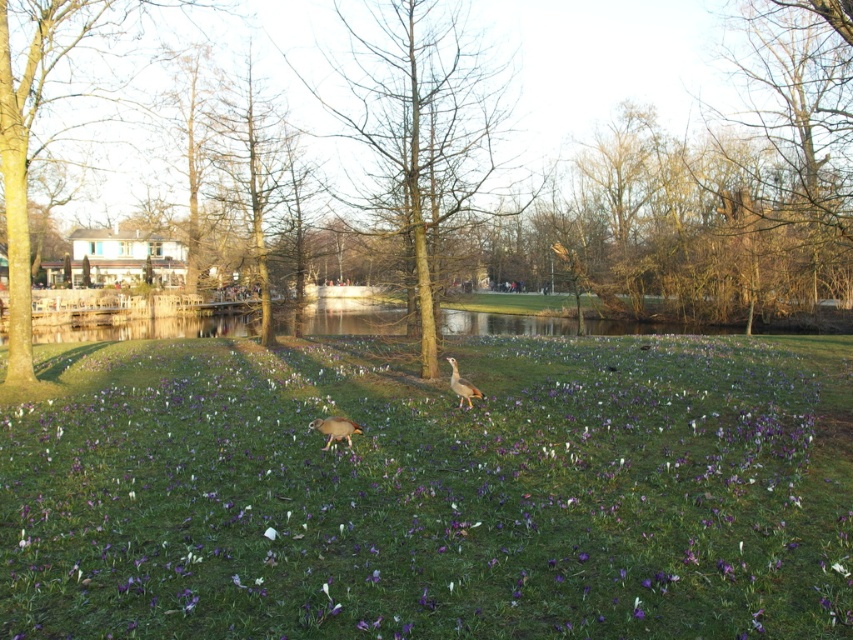
Who is positioned more to the right, green matte tree at center or brown/dry wood tree at center?

brown/dry wood tree at center is more to the right.

Is green matte tree at center behind brown/dry wood tree at center?

No, it is not.

Is point (473, 268) behind point (370, 109)?

Yes, point (473, 268) is behind point (370, 109).

Where is `green matte tree at center`? green matte tree at center is located at coordinates (593, 182).

Does brown/dry wood tree at center have a smaller size compared to brown matte duck at center?

No.

What do you see at coordinates (421, 131) in the screenshot?
I see `brown/dry wood tree at center` at bounding box center [421, 131].

Identify the location of brown/dry wood tree at center. Image resolution: width=853 pixels, height=640 pixels. (421, 131).

Which is more to the left, green leafy tree at left or brown matte duck at center?

green leafy tree at left

Can you confirm if green leafy tree at left is thinner than brown matte duck at center?

Incorrect, green leafy tree at left's width is not less than brown matte duck at center's.

What are the coordinates of `green leafy tree at left` in the screenshot? It's located at (33, 125).